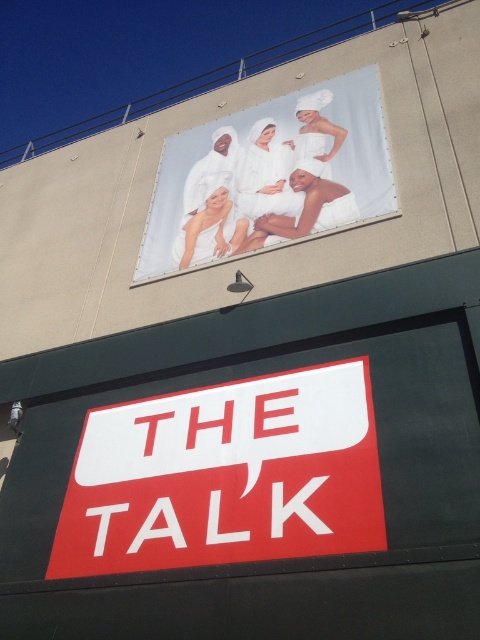
You are a delivery person trying to read the white matte sign at center and the white towel at upper center from the sidewalk. Which object is taller?

The white towel at upper center is taller than the white matte sign at center.

Consider the image. You are a delivery person trying to locate the entrance to the building. You see the white matte sign at center and the white towel at upper center in the image. Which object is closer to the entrance based on their positions?

The white matte sign at center is closer to the entrance than the white towel at upper center because it is positioned below it, indicating it is lower on the building and likely nearer to the ground level entrance.

You are standing at a point where you can see the billboard with the four individuals in white towels and the large red sign below it. If you want to reach the point exactly 3 meters away from your current position, will you be able to touch the point marked at coordinates point (x=225, y=541)?

The distance between your current position and point (x=225, y=541) is 3.43 meters. Since you want to reach a point exactly 3 meters away, you will not be able to touch the point marked at coordinates point (x=225, y=541) as it is further than 3 meters.